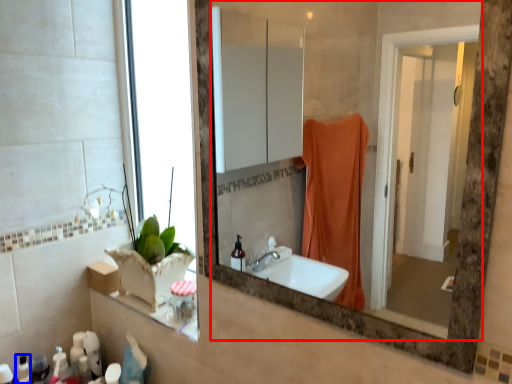
Question: Which of the following is the closest to the observer, mirror (highlighted by a red box) or toiletry (highlighted by a blue box)?

Choices:
 (A) mirror
 (B) toiletry

Answer: (A)